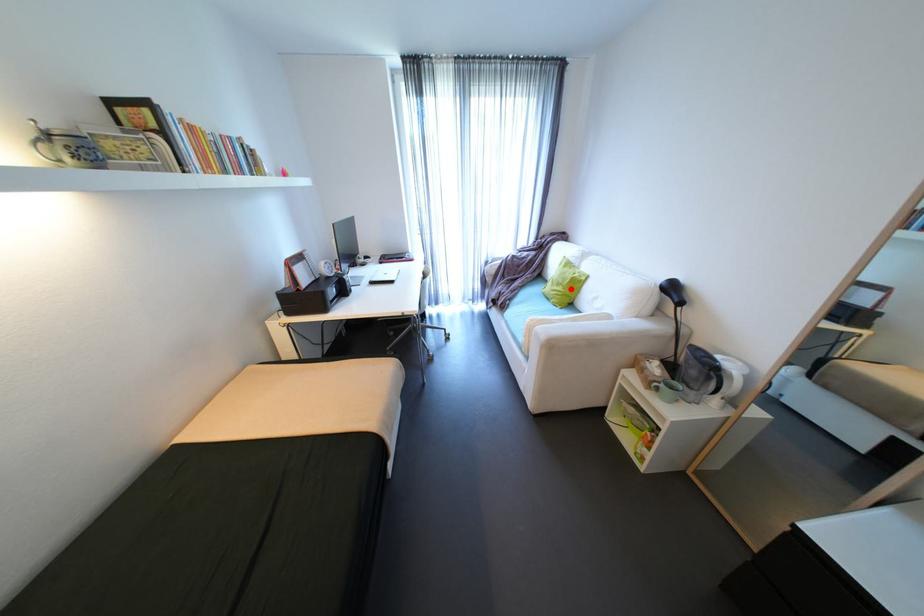
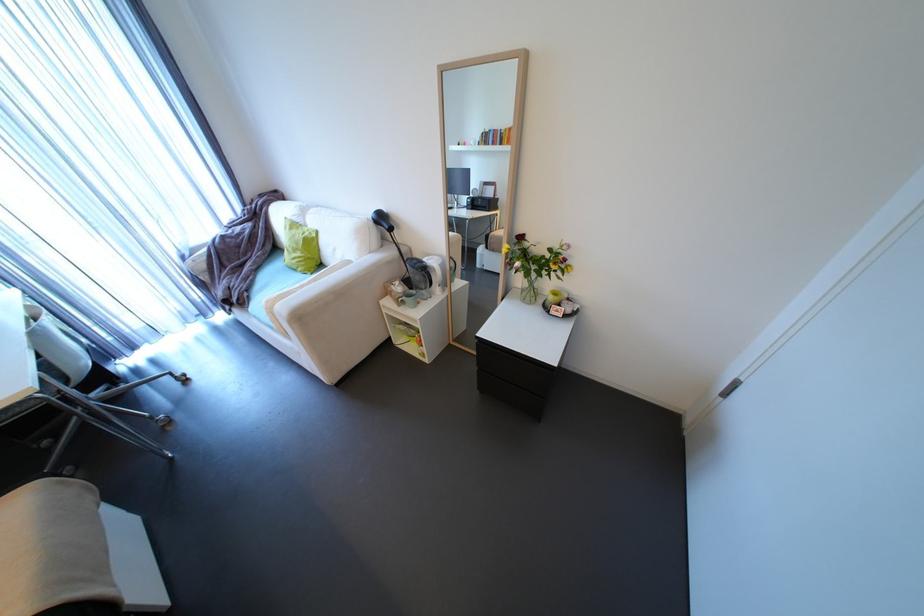
Question: I am providing you with two images of the same scene from different viewpoints. Image1 has a red point marked. In image2, the corresponding 3D location appears at what relative position? Reply with the corresponding letter.

Choices:
 (A) Closer
 (B) Farther

Answer: (B)